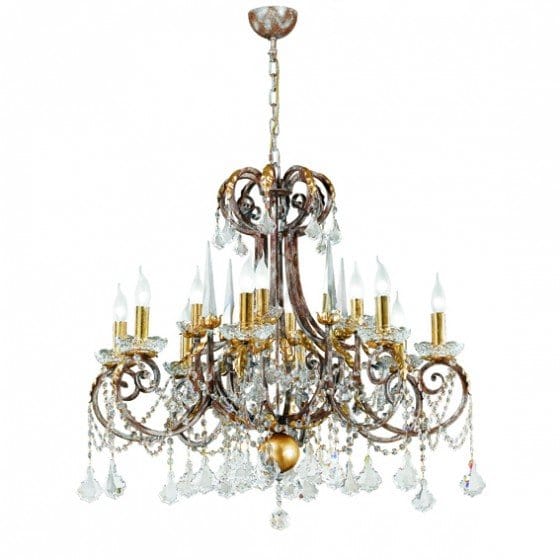
Locate an element on the screen. This screenshot has width=560, height=560. wire cover is located at coordinates (270, 20).